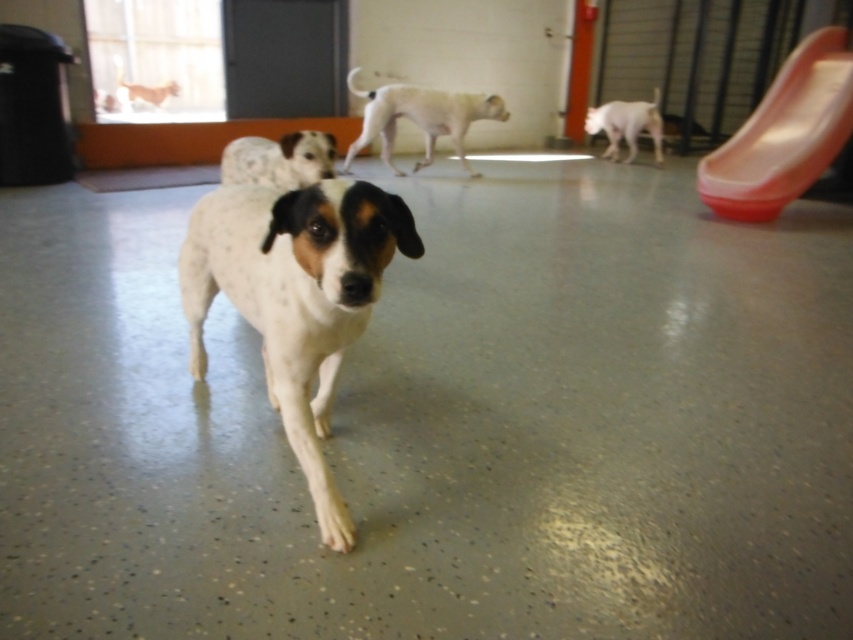
Question: Which point is closer to the camera?

Choices:
 (A) (328, 164)
 (B) (451, 118)
 (C) (753, 120)

Answer: (A)

Question: Which object is positioned farthest from the speckled white dog at center?

Choices:
 (A) speckled fur dog at center
 (B) white smooth dog at center
 (C) rubberized orange slide at upper right
 (D) white smooth dog at upper right

Answer: (D)

Question: Considering the real-world distances, which object is closest to the speckled fur dog at center?

Choices:
 (A) white smooth dog at center
 (B) rubberized orange slide at upper right
 (C) white smooth dog at upper right

Answer: (A)

Question: In this image, where is speckled fur dog at center located relative to white smooth dog at upper right?

Choices:
 (A) right
 (B) left

Answer: (B)

Question: Is speckled white dog at center positioned behind rubberized orange slide at upper right?

Choices:
 (A) no
 (B) yes

Answer: (A)

Question: Does speckled white dog at center have a greater width compared to white smooth dog at upper right?

Choices:
 (A) no
 (B) yes

Answer: (B)